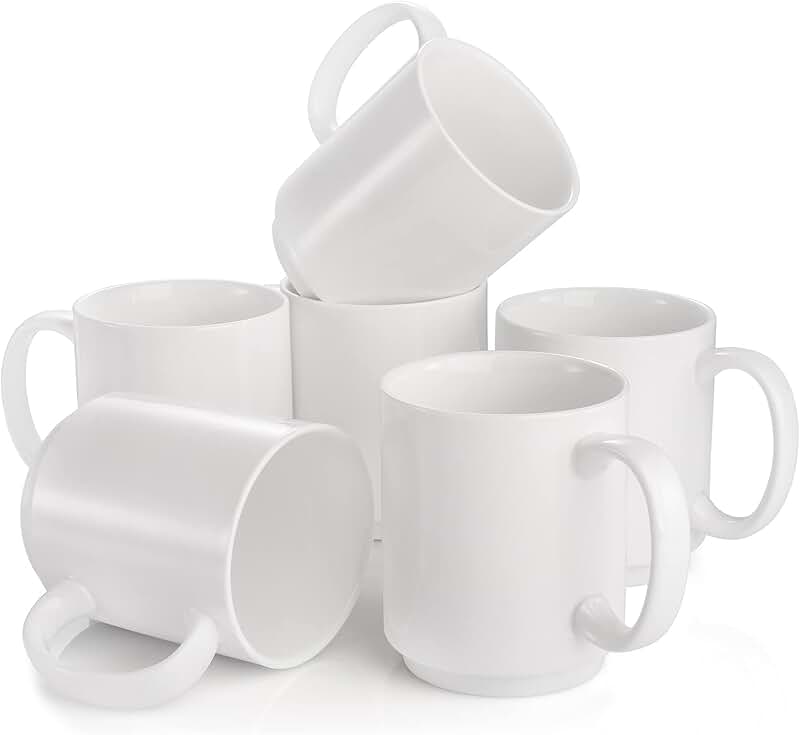
Where is `mugs standing straight up`? The height and width of the screenshot is (735, 800). mugs standing straight up is located at coordinates (229, 365), (337, 351), (662, 381), (516, 490).